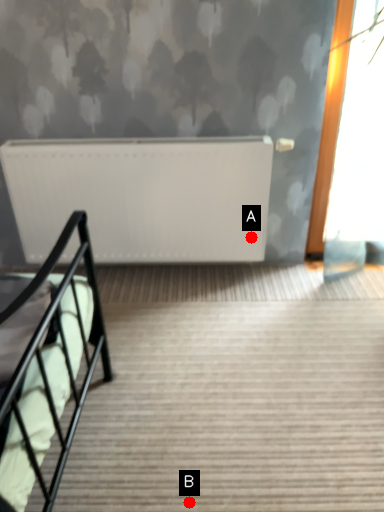
Question: Two points are circled on the image, labeled by A and B beside each circle. Among these points, which one is farthest from the camera?

Choices:
 (A) A is further
 (B) B is further

Answer: (A)